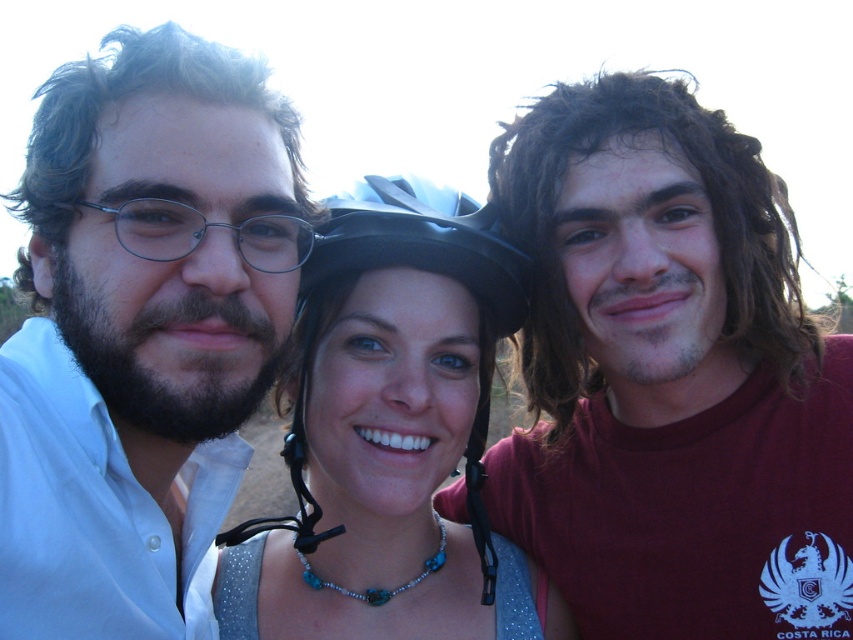
You are a photographer trying to capture a clear shot of the matte black helmet at upper center and the black matte helmet at center. Which helmet is located lower in the image?

The matte black helmet at upper center is positioned under the black matte helmet at center, meaning it is lower in the image.

You are a photographer trying to adjust the focus of your camera. You want to ensure that both the matte black glasses at left and the matte black helmet at upper center are in focus. Based on their positions, which object should you focus on first to achieve this?

You should focus on the matte black helmet at upper center first because the matte black glasses at left is behind it, so focusing on the closer object ensures both are in focus.